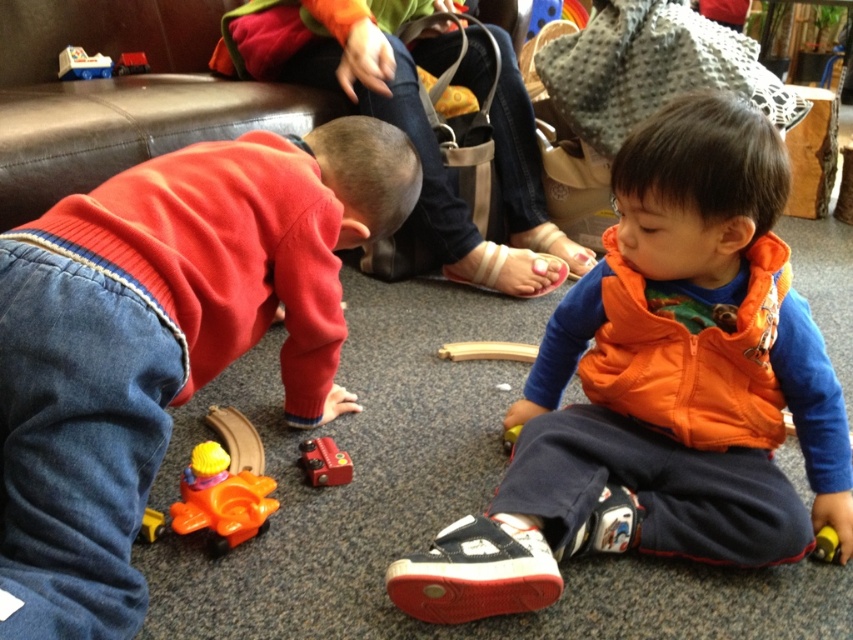
Is yellow plastic toy at lower right to the right of rubberized plastic toy car at center from the viewer's perspective?

Indeed, yellow plastic toy at lower right is positioned on the right side of rubberized plastic toy car at center.

Measure the distance between point (815,552) and camera.

They are 1.07 meters apart.

Where is `yellow plastic toy at lower right`? This screenshot has width=853, height=640. yellow plastic toy at lower right is located at coordinates (825, 545).

Between orange fleece vest at lower right and metallic red train at center, which one appears on the right side from the viewer's perspective?

Positioned to the right is orange fleece vest at lower right.

Is point (817, 401) closer to viewer compared to point (338, 458)?

Yes, point (817, 401) is in front of point (338, 458).

Does point (518, 518) come behind point (311, 445)?

No, it is in front of (311, 445).

This screenshot has height=640, width=853. What are the coordinates of `orange fleece vest at lower right` in the screenshot? It's located at (660, 387).

Measure the distance between yellow plastic toy at lower right and camera.

yellow plastic toy at lower right is 1.06 meters from camera.

Measure the distance between yellow plastic toy at lower right and rubberized orange train at lower left.

yellow plastic toy at lower right is 38.43 inches from rubberized orange train at lower left.

Is point (822, 548) positioned before point (149, 508)?

Yes, it is.

The height and width of the screenshot is (640, 853). In order to click on yellow plastic toy at lower right in this screenshot , I will do `click(825, 545)`.